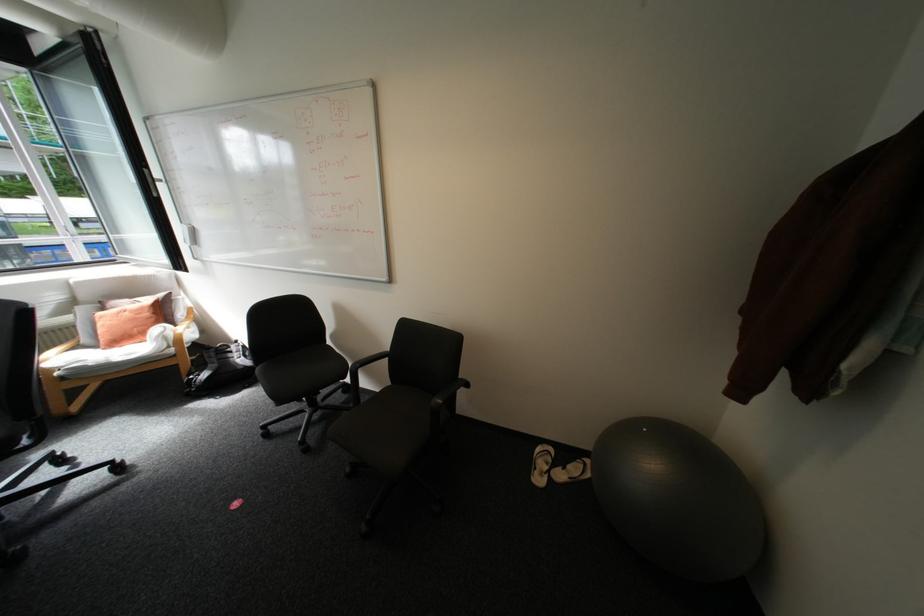
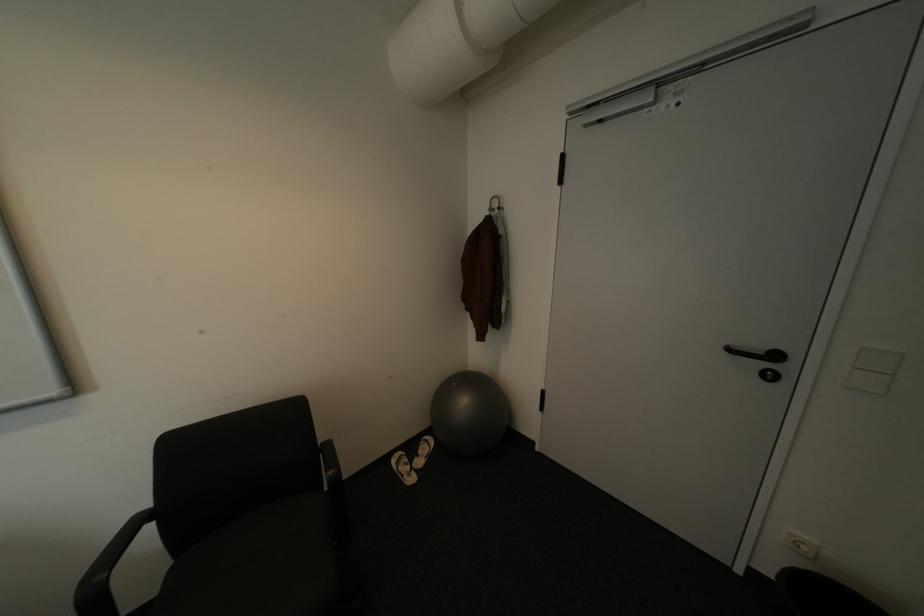
Find the pixel in the second image that matches [545,472] in the first image.

(415, 477)